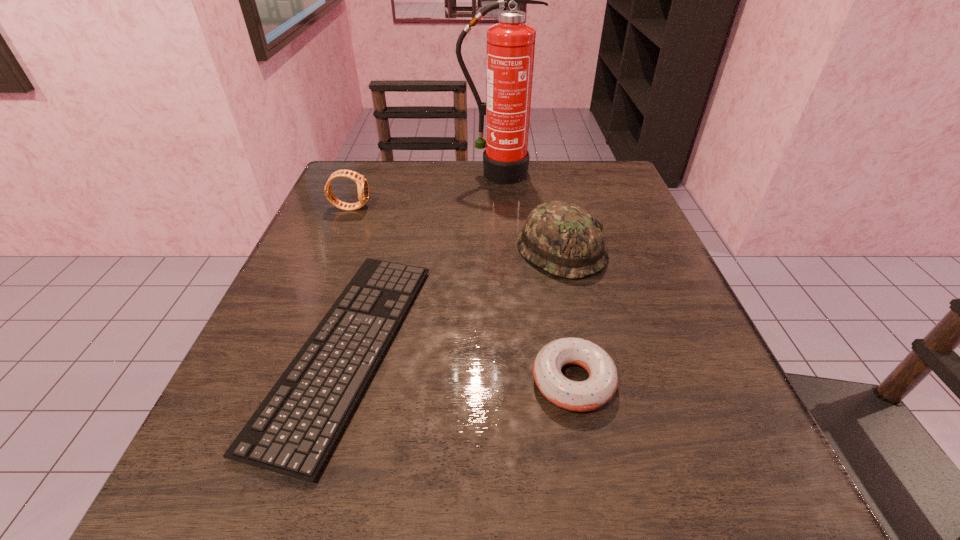
Image resolution: width=960 pixels, height=540 pixels. I want to click on the tallest object, so click(510, 43).

What are the coordinates of `the farthest object` in the screenshot? It's located at (510, 43).

The width and height of the screenshot is (960, 540). I want to click on headwear, so click(563, 239).

I want to click on watch, so click(362, 185).

Locate an element on the screen. Image resolution: width=960 pixels, height=540 pixels. the fourth tallest object is located at coordinates (598, 389).

At what (x,y) coordinates should I click in order to perform the action: click on the shortest object. Please return your answer as a coordinate pair (x, y). The image size is (960, 540). Looking at the image, I should click on (292, 432).

Where is `free location located on the front-facing side of the tallest object`? The height and width of the screenshot is (540, 960). free location located on the front-facing side of the tallest object is located at coordinates (502, 260).

In order to click on vacant space situated on the front of the headwear in this screenshot , I will do `click(604, 438)`.

Identify the location of vacant area located 0.370m on the face of the second farthest object. (535, 207).

Where is `vacant area situated 0.090m on the front of the fourth tallest object`? This screenshot has height=540, width=960. vacant area situated 0.090m on the front of the fourth tallest object is located at coordinates (593, 485).